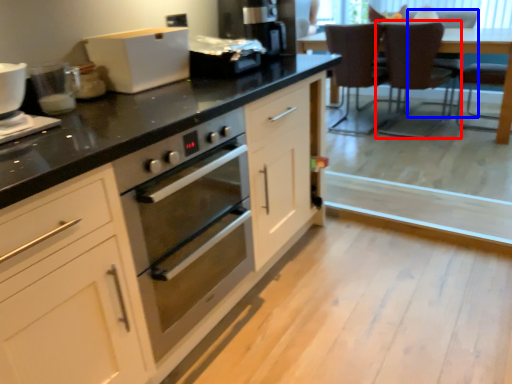
Question: Which point is closer to the camera, chair (highlighted by a red box) or armchair (highlighted by a blue box)?

Choices:
 (A) chair
 (B) armchair

Answer: (A)